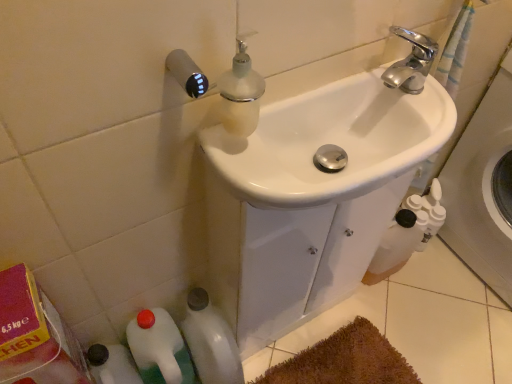
Question: Are white glossy sink at center and white plastic bottles at right located far from each other?

Choices:
 (A) no
 (B) yes

Answer: (A)

Question: Considering the relative sizes of white glossy sink at center and white plastic bottles at right in the image provided, is white glossy sink at center shorter than white plastic bottles at right?

Choices:
 (A) no
 (B) yes

Answer: (B)

Question: Can you confirm if white glossy sink at center is bigger than white plastic bottles at right?

Choices:
 (A) yes
 (B) no

Answer: (B)

Question: Does white glossy sink at center appear on the right side of white plastic bottles at right?

Choices:
 (A) yes
 (B) no

Answer: (B)

Question: Is the depth of white glossy sink at center greater than that of white plastic bottles at right?

Choices:
 (A) no
 (B) yes

Answer: (A)

Question: From the image's perspective, is white glossy sink at center under white plastic bottles at right?

Choices:
 (A) no
 (B) yes

Answer: (A)

Question: From the image's perspective, is white plastic bottle at lower left, which ranks as the 1th bottle in left-to-right order, on top of white glossy bottle at lower left, the second bottle when ordered from left to right?

Choices:
 (A) yes
 (B) no

Answer: (B)

Question: From a real-world perspective, is white plastic bottle at lower left, the second bottle when ordered from right to left, on white glossy bottle at lower left, the second bottle when ordered from left to right?

Choices:
 (A) no
 (B) yes

Answer: (B)

Question: Considering the relative sizes of white plastic bottle at lower left, the second bottle when ordered from right to left, and white glossy bottle at lower left, the first bottle when ordered from right to left, in the image provided, is white plastic bottle at lower left, the second bottle when ordered from right to left, taller than white glossy bottle at lower left, the first bottle when ordered from right to left,?

Choices:
 (A) no
 (B) yes

Answer: (B)

Question: Is white plastic bottle at lower left, which ranks as the 1th bottle in left-to-right order, wider than white glossy bottle at lower left, the first bottle when ordered from right to left?

Choices:
 (A) yes
 (B) no

Answer: (B)

Question: Is white plastic bottle at lower left, which ranks as the 1th bottle in left-to-right order, positioned in front of white glossy bottle at lower left, the first bottle when ordered from right to left?

Choices:
 (A) no
 (B) yes

Answer: (B)

Question: Considering the relative positions of white plastic bottle at lower left, which ranks as the 1th bottle in left-to-right order, and white glossy bottle at lower left, the second bottle when ordered from left to right, in the image provided, is white plastic bottle at lower left, which ranks as the 1th bottle in left-to-right order, to the left of white glossy bottle at lower left, the second bottle when ordered from left to right, from the viewer's perspective?

Choices:
 (A) no
 (B) yes

Answer: (B)

Question: Is white glossy bottle at lower left, the second bottle when ordered from left to right, bigger than white plastic bottle at lower left, which ranks as the 1th bottle in left-to-right order?

Choices:
 (A) yes
 (B) no

Answer: (B)